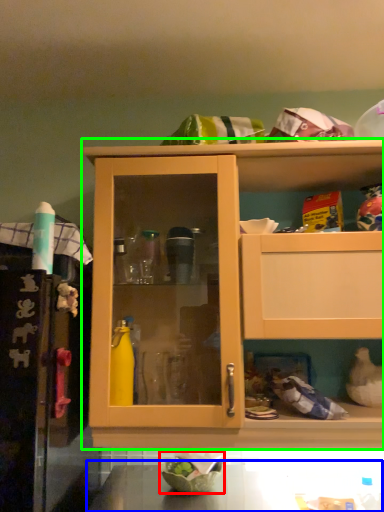
Question: Which object is the closest to the bowl (highlighted by a red box)? Choose among these: counter top (highlighted by a blue box) or cabinetry (highlighted by a green box).

Choices:
 (A) counter top
 (B) cabinetry

Answer: (A)